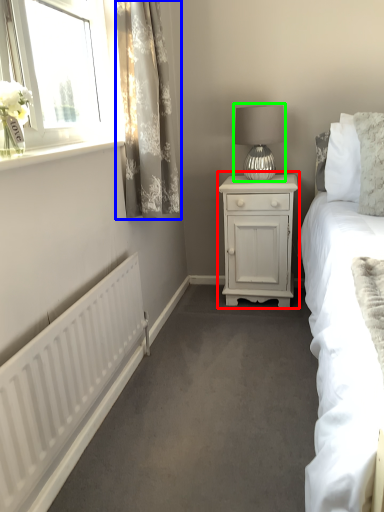
Question: Which is nearer to the nightstand (highlighted by a red box)? curtain (highlighted by a blue box) or table lamp (highlighted by a green box).

Choices:
 (A) curtain
 (B) table lamp

Answer: (B)